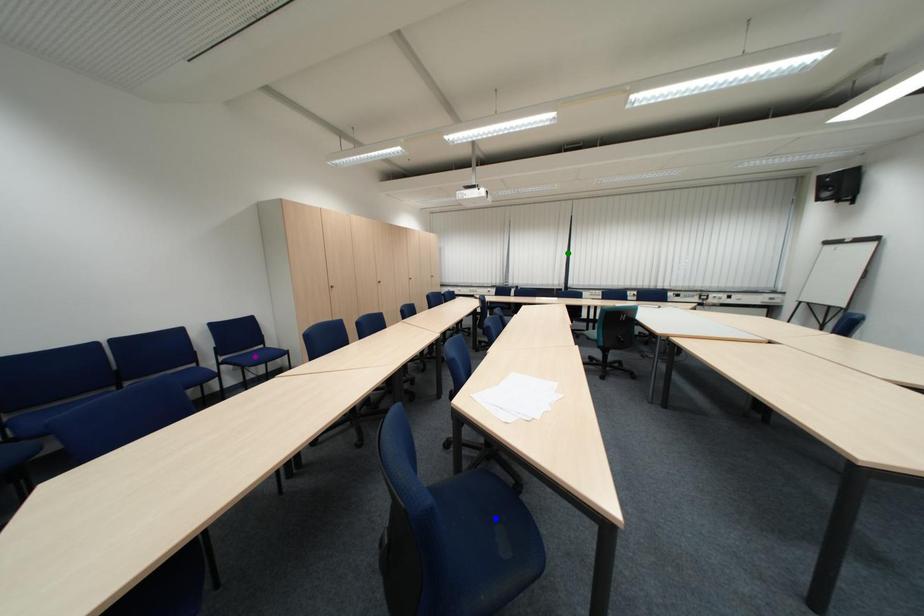
Order these from nearest to farthest:
- purple point
- green point
- blue point

green point, purple point, blue point